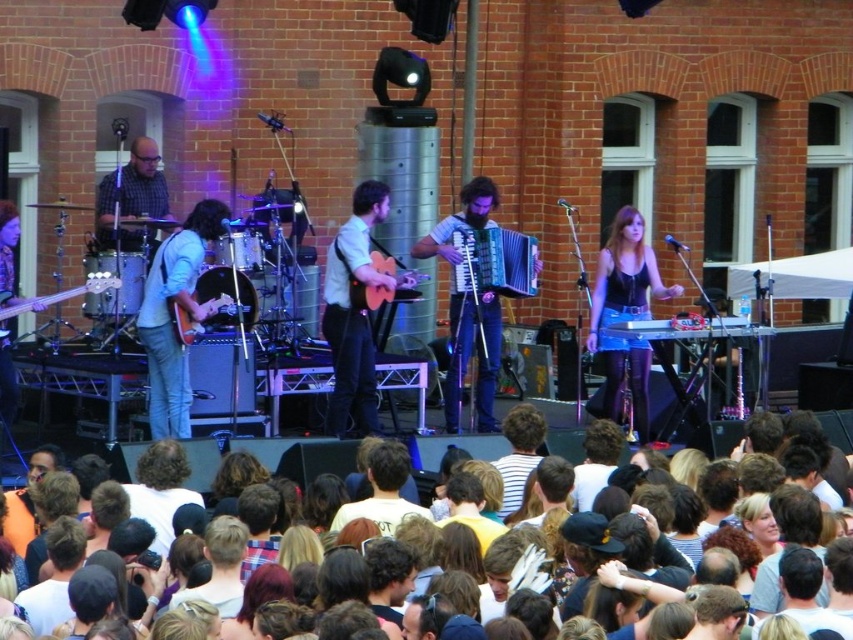
Question: Which is nearer to the matte wood guitar at center?

Choices:
 (A) metallic silver keyboard at center
 (B) matte wood guitar at left
 (C) matte black bass guitar at left

Answer: (B)

Question: Where is metallic silver accordion at center located in relation to orange matte guitar at center in the image?

Choices:
 (A) below
 (B) above

Answer: (B)

Question: Which point is closer to the camera?

Choices:
 (A) (117, 214)
 (B) (340, 356)

Answer: (B)

Question: Is metallic silver accordion at center bigger than metallic silver keyboard at center?

Choices:
 (A) yes
 (B) no

Answer: (A)

Question: Observing the image, what is the correct spatial positioning of matte wood guitar at center in reference to wooden accordion at center?

Choices:
 (A) below
 (B) above

Answer: (B)

Question: Which point is closer to the camera?

Choices:
 (A) (363, 380)
 (B) (177, 301)

Answer: (B)